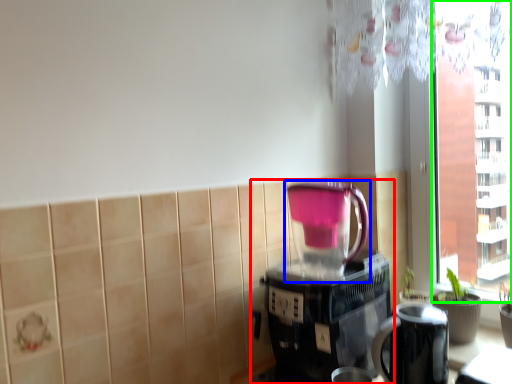
Question: Which object is the closest to the coffee maker (highlighted by a red box)? Choose among these: blender (highlighted by a blue box) or window screen (highlighted by a green box).

Choices:
 (A) blender
 (B) window screen

Answer: (A)